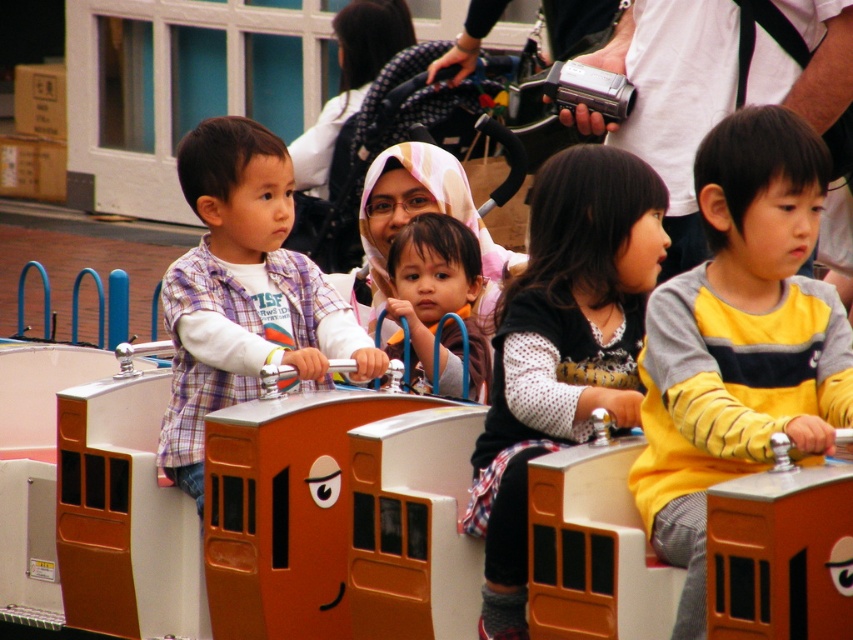
You are a photographer at the amusement park and want to capture a photo of the yellow striped sweater at center and white dotted sweater at center. Since you want to highlight the size difference between them, which one should you position closer to the camera?

The yellow striped sweater at center is bigger than the white dotted sweater at center, so to highlight the size difference, position the smaller white dotted sweater at center closer to the camera.

You are a parent standing at the entrance of the train ride. You see your child wearing a yellow striped sweater at center and another child wearing a plaid fabric shirt at left. If you want to reach your child first, which child should you approach? Please explain your reasoning based on their positions.

The plaid fabric shirt at left is closer to the entrance than the yellow striped sweater at center. Therefore, you should approach the child wearing the plaid fabric shirt at left first since they are nearer to you.

You are standing at the origin point in the image. The yellow striped sweater at center is located at coordinates point [740,339]. If you want to move towards the yellow striped sweater at center, in which direction should you move?

The yellow striped sweater at center is located at coordinates point [740,339]. Since the coordinate system is not specified, but assuming standard image coordinates where the origin is at the bottom left corner, moving towards the yellow striped sweater at center would require moving right and up from the origin.